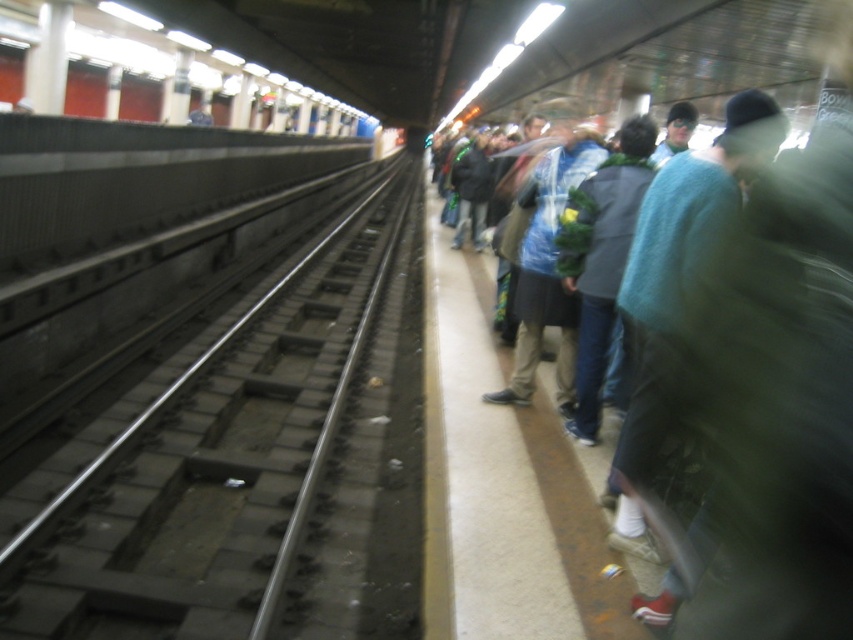
Question: Is concrete track at left wider than metallic gray train at upper left?

Choices:
 (A) no
 (B) yes

Answer: (A)

Question: Does concrete track at left lie in front of metallic gray train at upper left?

Choices:
 (A) yes
 (B) no

Answer: (A)

Question: Can you confirm if concrete track at left is positioned to the left of metallic gray train at upper left?

Choices:
 (A) no
 (B) yes

Answer: (A)

Question: Which point is farther to the camera?

Choices:
 (A) (136, 394)
 (B) (103, 0)

Answer: (B)

Question: Which object is closer to the camera taking this photo?

Choices:
 (A) metallic gray train at upper left
 (B) concrete track at left

Answer: (B)